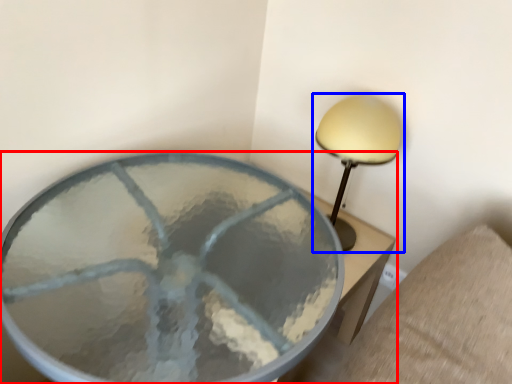
Question: Which object is further to the camera taking this photo, table (highlighted by a red box) or lamp (highlighted by a blue box)?

Choices:
 (A) table
 (B) lamp

Answer: (B)